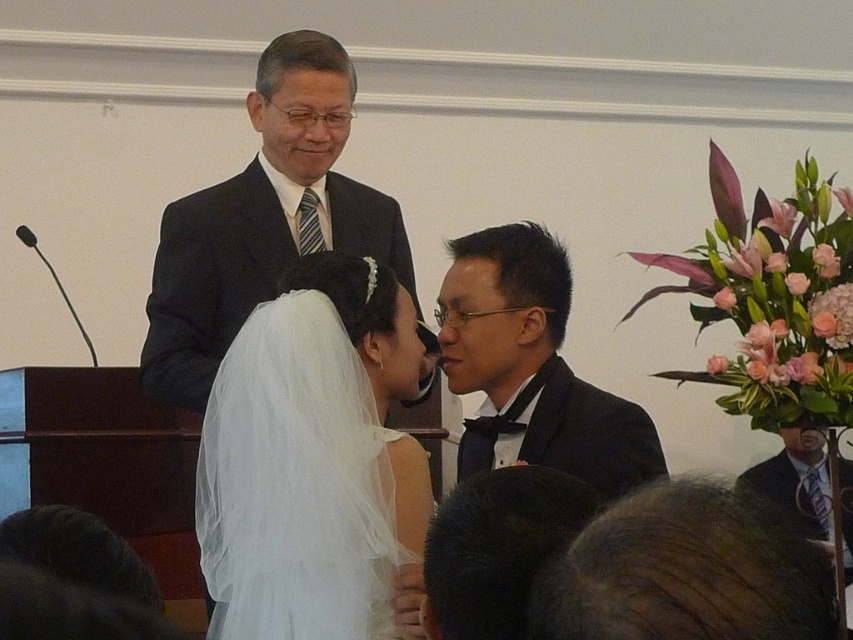
You are a photographer at a wedding. You need to adjust the camera focus to ensure both the dark blue suit at upper center and the black satin suit at center are in focus. Given that the camera can only focus on one height, which suit should you prioritize focusing on based on their heights?

The dark blue suit at upper center is taller than the black satin suit at center, so you should prioritize focusing on the dark blue suit at upper center to ensure proper focus.

You are a photographer at the wedding. You need to capture a closeup shot of the bride and groom. Since the white tulle veil at center and the dark blue suit at upper center are both in the frame, which one would you focus on to ensure the veil is in sharp focus?

The white tulle veil at center is thinner than the dark blue suit at upper center, so focusing on the veil would ensure it is in sharp focus because it has less depth compared to the suit.